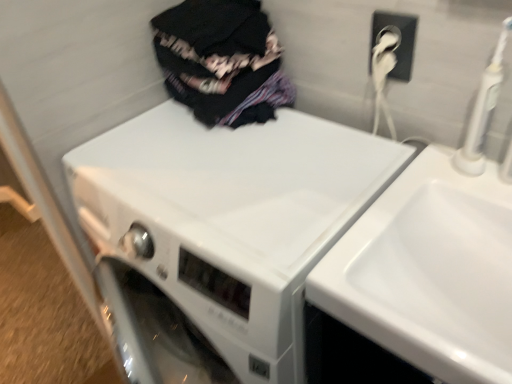
Question: From the image's perspective, would you say white glossy sink at upper right is shown under white glossy washing machine at center?

Choices:
 (A) yes
 (B) no

Answer: (B)

Question: Is white glossy sink at upper right far away from white glossy washing machine at center?

Choices:
 (A) no
 (B) yes

Answer: (A)

Question: Is white glossy sink at upper right placed right next to white glossy washing machine at center?

Choices:
 (A) no
 (B) yes

Answer: (A)

Question: Is white glossy sink at upper right located outside white glossy washing machine at center?

Choices:
 (A) yes
 (B) no

Answer: (A)

Question: Does white glossy sink at upper right have a larger size compared to white glossy washing machine at center?

Choices:
 (A) yes
 (B) no

Answer: (B)

Question: From the image's perspective, is dark fabric clothes at upper center above or below white glossy washing machine at center?

Choices:
 (A) above
 (B) below

Answer: (A)

Question: Considering the positions of point (200, 97) and point (205, 178), is point (200, 97) closer or farther from the camera than point (205, 178)?

Choices:
 (A) closer
 (B) farther

Answer: (B)

Question: Is dark fabric clothes at upper center spatially inside white glossy washing machine at center, or outside of it?

Choices:
 (A) outside
 (B) inside

Answer: (A)

Question: In the image, is dark fabric clothes at upper center on the left side or the right side of white glossy washing machine at center?

Choices:
 (A) right
 (B) left

Answer: (B)

Question: From a real-world perspective, is white plastic electric outlet at upper right positioned above or below white glossy sink at upper right?

Choices:
 (A) below
 (B) above

Answer: (B)

Question: From the image's perspective, is white plastic electric outlet at upper right positioned above or below white glossy sink at upper right?

Choices:
 (A) below
 (B) above

Answer: (B)

Question: Which is correct: white plastic electric outlet at upper right is inside white glossy sink at upper right, or outside of it?

Choices:
 (A) outside
 (B) inside

Answer: (A)

Question: Does point (402, 46) appear closer or farther from the camera than point (374, 246)?

Choices:
 (A) farther
 (B) closer

Answer: (A)

Question: From the image's perspective, is white glossy sink at upper right located above or below white glossy washing machine at center?

Choices:
 (A) below
 (B) above

Answer: (B)

Question: Is white glossy sink at upper right bigger or smaller than white glossy washing machine at center?

Choices:
 (A) big
 (B) small

Answer: (B)